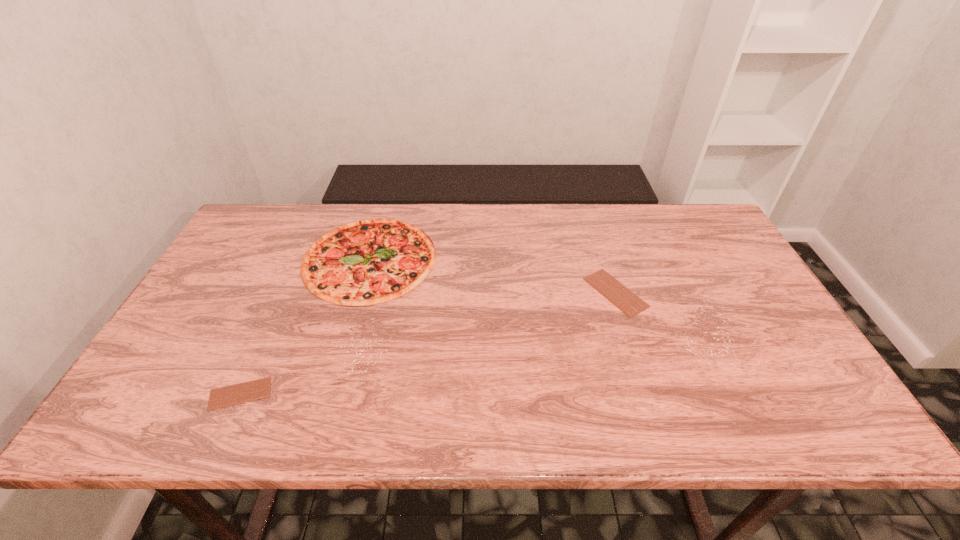
Find the location of a particular element. Image resolution: width=960 pixels, height=540 pixels. object that is at the left edge is located at coordinates (226, 396).

Identify the location of object present at the near left corner. The height and width of the screenshot is (540, 960). (226, 396).

Where is `vacant space at the far edge of the desktop`? The height and width of the screenshot is (540, 960). vacant space at the far edge of the desktop is located at coordinates (630, 213).

Where is `vacant space at the near edge of the desktop`? Image resolution: width=960 pixels, height=540 pixels. vacant space at the near edge of the desktop is located at coordinates (750, 421).

Find the location of a particular element. The width and height of the screenshot is (960, 540). free space at the left edge of the desktop is located at coordinates (207, 313).

Where is `free location at the far left corner`? The height and width of the screenshot is (540, 960). free location at the far left corner is located at coordinates (276, 249).

Where is `vacant space at the far right corner of the desktop`? vacant space at the far right corner of the desktop is located at coordinates (680, 218).

What are the coordinates of `blank region between the nearer chocolate bar and the tallest object` in the screenshot? It's located at (305, 326).

This screenshot has height=540, width=960. Find the location of `unoccupied position between the tallest object and the nearest object`. unoccupied position between the tallest object and the nearest object is located at coordinates (305, 326).

Locate an element on the screen. The width and height of the screenshot is (960, 540). free spot between the nearer chocolate bar and the tallest object is located at coordinates (305, 326).